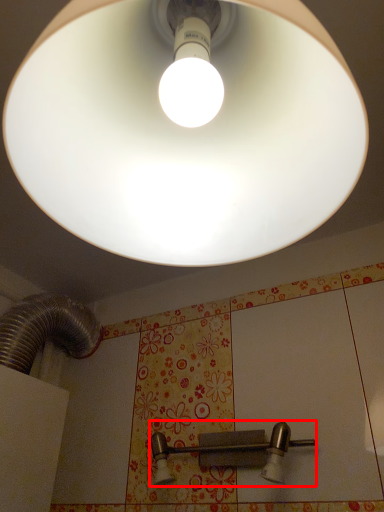
Question: From the image's perspective, what is the correct spatial relationship of door handle (annotated by the red box) in relation to lamp?

Choices:
 (A) above
 (B) below

Answer: (B)